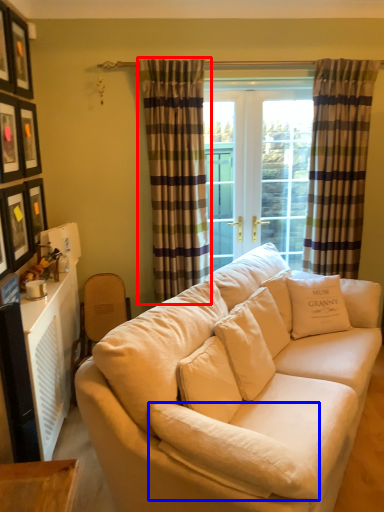
Question: Which point is closer to the camera, curtain (highlighted by a red box) or pillow (highlighted by a blue box)?

Choices:
 (A) curtain
 (B) pillow

Answer: (B)